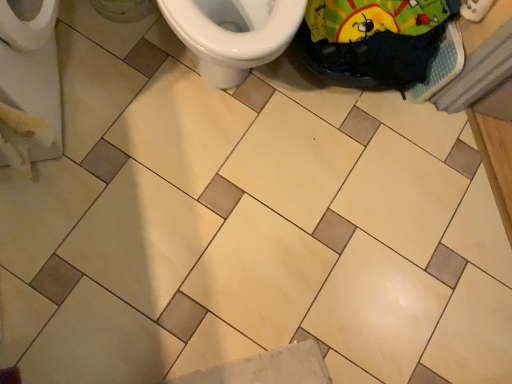
What is the approximate height of green fabric bag at upper right?

green fabric bag at upper right is 8.48 inches tall.

Locate an element on the screen. green fabric bag at upper right is located at coordinates (376, 39).

What do you see at coordinates (376, 39) in the screenshot? The height and width of the screenshot is (384, 512). I see `green fabric bag at upper right` at bounding box center [376, 39].

What do you see at coordinates (233, 34) in the screenshot? The width and height of the screenshot is (512, 384). I see `white glossy toilet at upper center` at bounding box center [233, 34].

The height and width of the screenshot is (384, 512). I want to click on white glossy toilet at upper center, so click(x=233, y=34).

Identify the location of green fabric bag at upper right. (376, 39).

Considering the positions of objects white glossy toilet at upper center and green fabric bag at upper right in the image provided, who is more to the left, white glossy toilet at upper center or green fabric bag at upper right?

From the viewer's perspective, white glossy toilet at upper center appears more on the left side.

Which object is further away from the camera, white glossy toilet at upper center or green fabric bag at upper right?

Positioned behind is green fabric bag at upper right.

Which is in front, point (259, 23) or point (316, 70)?

Point (259, 23)

From the image's perspective, is white glossy toilet at upper center below green fabric bag at upper right?

Incorrect, from the image's perspective, white glossy toilet at upper center is higher than green fabric bag at upper right.

From a real-world perspective, is white glossy toilet at upper center physically above green fabric bag at upper right?

Yes.

Considering the relative sizes of white glossy toilet at upper center and green fabric bag at upper right in the image provided, is white glossy toilet at upper center thinner than green fabric bag at upper right?

No.

Between white glossy toilet at upper center and green fabric bag at upper right, which one has less height?

green fabric bag at upper right.

Is white glossy toilet at upper center bigger or smaller than green fabric bag at upper right?

Considering their sizes, white glossy toilet at upper center takes up more space than green fabric bag at upper right.

Is green fabric bag at upper right located within white glossy toilet at upper center?

No, green fabric bag at upper right is located outside of white glossy toilet at upper center.

Is white glossy toilet at upper center not close to green fabric bag at upper right?

They are positioned close to each other.

Is white glossy toilet at upper center aimed at green fabric bag at upper right?

No, white glossy toilet at upper center does not turn towards green fabric bag at upper right.

At what (x,y) coordinates should I click in order to perform the action: click on material to the right of white glossy toilet at upper center. Please return your answer as a coordinate pair (x, y). The width and height of the screenshot is (512, 384). Looking at the image, I should click on (376, 39).

In the image, is green fabric bag at upper right on the left side or the right side of white glossy toilet at upper center?

Based on their positions, green fabric bag at upper right is located to the right of white glossy toilet at upper center.

Does green fabric bag at upper right come behind white glossy toilet at upper center?

Yes, green fabric bag at upper right is further from the camera.

Considering the positions of points (424, 19) and (271, 43), is point (424, 19) closer to camera compared to point (271, 43)?

No, it is not.

From the image's perspective, who appears lower, green fabric bag at upper right or white glossy toilet at upper center?

green fabric bag at upper right, from the image's perspective.

From a real-world perspective, is green fabric bag at upper right physically below white glossy toilet at upper center?

Yes, from a real-world perspective, green fabric bag at upper right is beneath white glossy toilet at upper center.

Which of these two, green fabric bag at upper right or white glossy toilet at upper center, is wider?

white glossy toilet at upper center.

Considering the sizes of objects green fabric bag at upper right and white glossy toilet at upper center in the image provided, who is shorter, green fabric bag at upper right or white glossy toilet at upper center?

green fabric bag at upper right is shorter.

Which of these two, green fabric bag at upper right or white glossy toilet at upper center, is smaller?

green fabric bag at upper right.

Could white glossy toilet at upper center be considered to be inside green fabric bag at upper right?

No, white glossy toilet at upper center is not inside green fabric bag at upper right.

Would you consider green fabric bag at upper right to be distant from white glossy toilet at upper center?

green fabric bag at upper right is actually quite close to white glossy toilet at upper center.

Is green fabric bag at upper right turned away from white glossy toilet at upper center?

That's not correct — green fabric bag at upper right is not looking away from white glossy toilet at upper center.

Measure the distance from green fabric bag at upper right to white glossy toilet at upper center.

green fabric bag at upper right and white glossy toilet at upper center are 11.70 inches apart.

The image size is (512, 384). What are the coordinates of `material that is on the right side of white glossy toilet at upper center` in the screenshot? It's located at (376, 39).

Identify the location of toilet on the left of green fabric bag at upper right. (233, 34).

Where is `toilet that appears above the green fabric bag at upper right (from a real-world perspective)`? The height and width of the screenshot is (384, 512). toilet that appears above the green fabric bag at upper right (from a real-world perspective) is located at coordinates (233, 34).